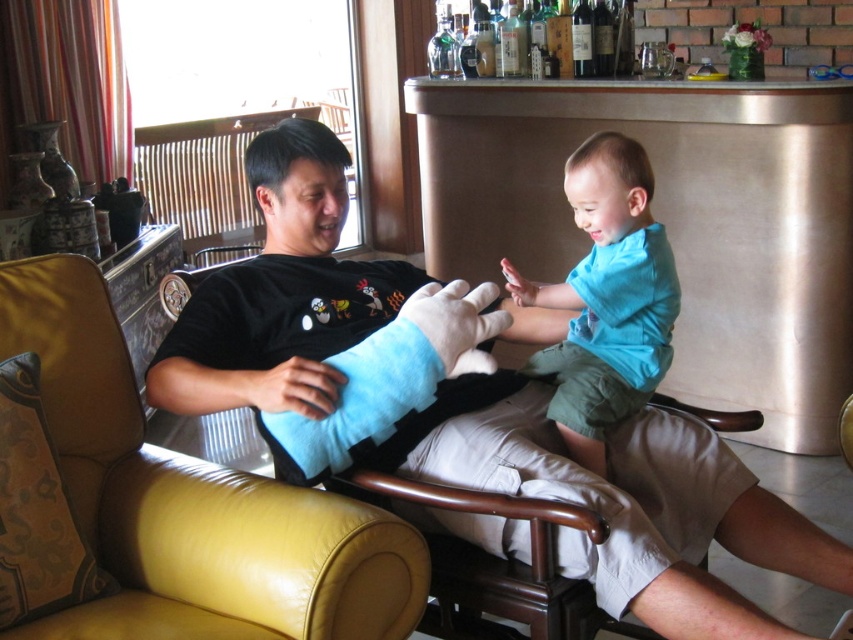
Is blue soft plush at center thinner than velvet-like yellow pillow at lower left?

No, blue soft plush at center is not thinner than velvet-like yellow pillow at lower left.

Between point (439, 342) and point (62, 486), which one is positioned behind?

The point (439, 342) is more distant.

Does point (457, 333) lie in front of point (22, 554)?

No, (457, 333) is further to viewer.

This screenshot has height=640, width=853. Identify the location of blue soft plush at center. (390, 378).

Does blue cotton shirt at upper right come in front of blue soft plush at center?

No, blue cotton shirt at upper right is further to the viewer.

Between blue cotton shirt at upper right and blue soft plush at center, which one is positioned lower?

blue soft plush at center

Which is in front, point (636, 157) or point (395, 422)?

Point (395, 422) is in front.

Locate an element on the screen. This screenshot has width=853, height=640. blue cotton shirt at upper right is located at coordinates (606, 298).

Is blue plush toy at center thinner than blue cotton shirt at upper right?

No.

You are a GUI agent. You are given a task and a screenshot of the screen. Output one action in this format:
    pyautogui.click(x=<x>, y=<y>)
    Task: Click on the blue plush toy at center
    This screenshot has height=640, width=853.
    Given the screenshot: What is the action you would take?
    pyautogui.click(x=463, y=404)